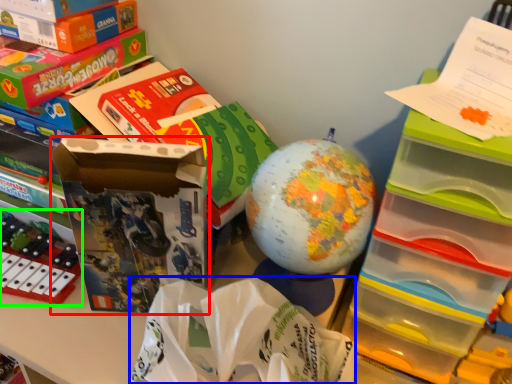
Question: Based on their relative distances, which object is nearer to storage box (highlighted by a red box)? Choose from paper bag (highlighted by a blue box) and toy (highlighted by a green box).

Choices:
 (A) paper bag
 (B) toy

Answer: (A)